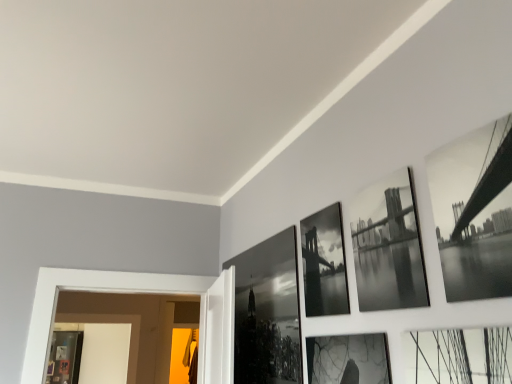
Question: Which direction should I rotate to look at black glossy photo frame at center, acting as the third picture frame starting from the right, — up or down?

Choices:
 (A) down
 (B) up

Answer: (A)

Question: Can you confirm if black glossy bridge at upper right, which is the first picture frame in front-to-back order, is positioned to the left of black glossy photo frame at upper center, the second picture frame viewed from the front?

Choices:
 (A) no
 (B) yes

Answer: (A)

Question: From a real-world perspective, is black glossy bridge at upper right, the fourth picture frame when ordered from back to front, under black glossy photo frame at upper center, which is counted as the third picture frame, starting from the back?

Choices:
 (A) yes
 (B) no

Answer: (B)

Question: Does black glossy bridge at upper right, arranged as the fourth picture frame when viewed from the left, have a greater height compared to black glossy photo frame at upper center, the 2th picture frame positioned from the right?

Choices:
 (A) no
 (B) yes

Answer: (A)

Question: Is black glossy bridge at upper right, arranged as the fourth picture frame when viewed from the left, thinner than black glossy photo frame at upper center, the 2th picture frame positioned from the right?

Choices:
 (A) yes
 (B) no

Answer: (B)

Question: From the image's perspective, is black glossy bridge at upper right, arranged as the fourth picture frame when viewed from the left, on black glossy photo frame at upper center, the second picture frame viewed from the front?

Choices:
 (A) no
 (B) yes

Answer: (B)

Question: Is black glossy bridge at upper right, acting as the first picture frame starting from the right, at the right side of black glossy photo frame at upper center, which is counted as the third picture frame, starting from the back?

Choices:
 (A) yes
 (B) no

Answer: (A)

Question: Considering the relative positions of black glossy photo frame at center, arranged as the first picture frame when viewed from the back, and black glossy photo frame at upper center, the second picture frame viewed from the front, in the image provided, is black glossy photo frame at center, arranged as the first picture frame when viewed from the back, behind black glossy photo frame at upper center, the second picture frame viewed from the front,?

Choices:
 (A) no
 (B) yes

Answer: (B)

Question: Is black glossy photo frame at center, acting as the 1th picture frame starting from the left, not inside black glossy photo frame at upper center, which is counted as the third picture frame, starting from the back?

Choices:
 (A) yes
 (B) no

Answer: (A)

Question: Is black glossy photo frame at center, the 4th picture frame when ordered from right to left, in front of black glossy photo frame at upper center, positioned as the 3th picture frame in left-to-right order?

Choices:
 (A) yes
 (B) no

Answer: (B)

Question: Is black glossy photo frame at center, the 4th picture frame when ordered from right to left, at the right side of black glossy photo frame at upper center, positioned as the 3th picture frame in left-to-right order?

Choices:
 (A) yes
 (B) no

Answer: (B)

Question: From a real-world perspective, is black glossy photo frame at center, arranged as the fourth picture frame when viewed from the front, positioned over black glossy photo frame at upper center, the 2th picture frame positioned from the right, based on gravity?

Choices:
 (A) yes
 (B) no

Answer: (B)

Question: From the image's perspective, is black glossy photo frame at center, acting as the 1th picture frame starting from the left, on black glossy photo frame at upper center, the 2th picture frame positioned from the right?

Choices:
 (A) yes
 (B) no

Answer: (B)

Question: From a real-world perspective, does black glossy photo frame at upper center, positioned as the 3th picture frame in left-to-right order, sit lower than black glossy bridge at upper right, arranged as the fourth picture frame when viewed from the left?

Choices:
 (A) no
 (B) yes

Answer: (B)